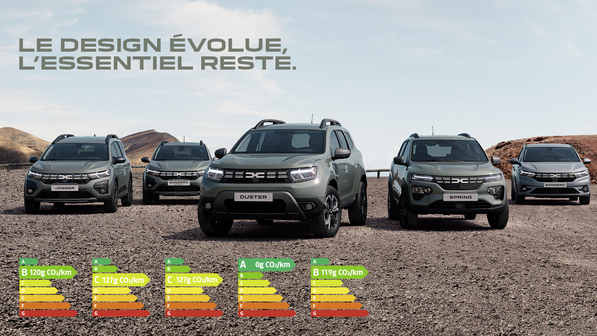
At what (x,y) coordinates should I click in order to perform the action: click on light orange bar. Please return your answer as a coordinate pair (x, y). Looking at the image, I should click on (337, 298), (269, 296), (193, 297), (97, 295), (56, 298).